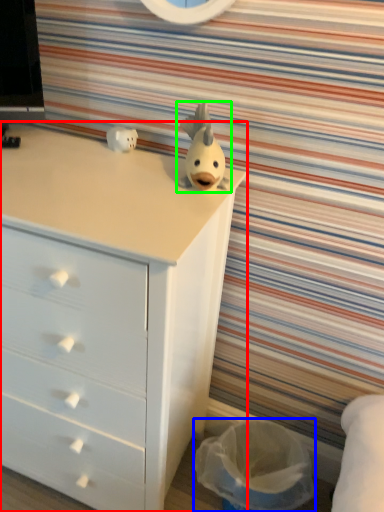
Question: Estimate the real-world distances between objects in this image. Which object is closer to chest of drawers (highlighted by a red box), laundry basket (highlighted by a blue box) or toy (highlighted by a green box)?

Choices:
 (A) laundry basket
 (B) toy

Answer: (B)